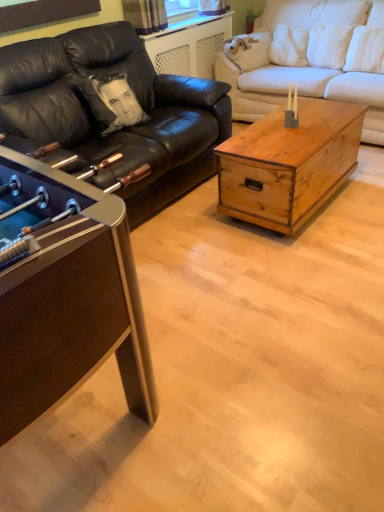
Where is `vacant point to the right of metallic brown foosball table at left, the second coffee table positioned from the right`? The height and width of the screenshot is (512, 384). vacant point to the right of metallic brown foosball table at left, the second coffee table positioned from the right is located at coordinates (250, 331).